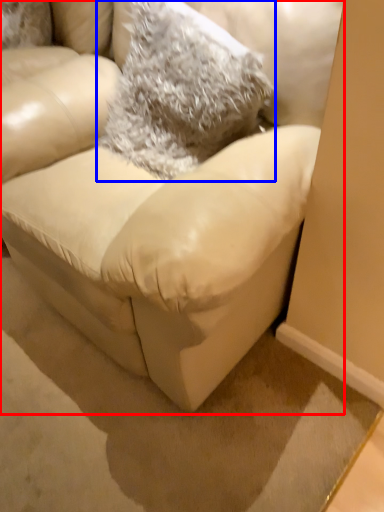
Question: Which of the following is the closest to the observer, studio couch (highlighted by a red box) or throw pillow (highlighted by a blue box)?

Choices:
 (A) studio couch
 (B) throw pillow

Answer: (A)